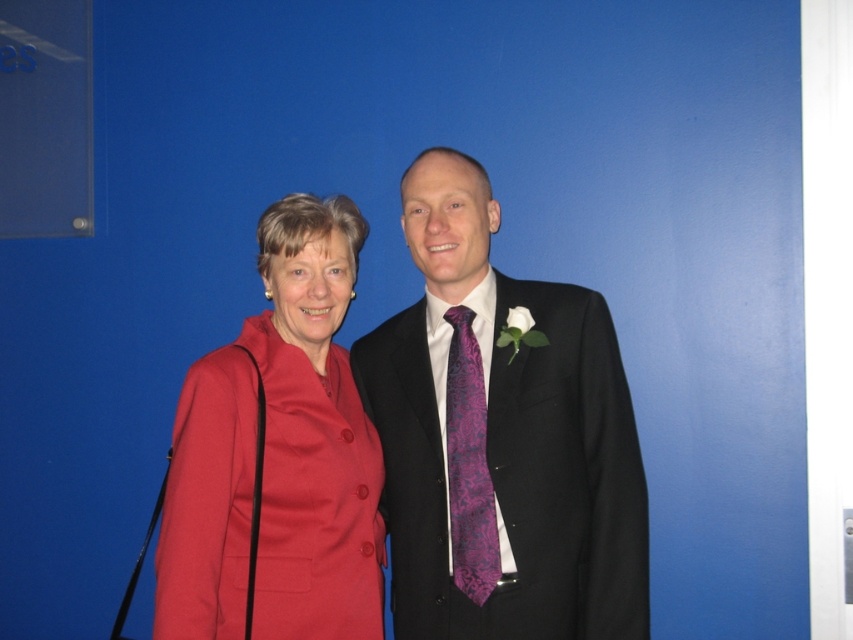
You are a photographer setting up for a portrait session. You have a camera with a focal length of 50mm and want to ensure the matte black suit at center is in focus. If the recommended focusing distance for this setup is between 5 and 6 feet, is the current distance appropriate?

The distance of matte black suit at center from camera is 5.65 feet, which falls within the recommended focusing distance range of 5 to 6 feet. Therefore, the current distance is appropriate for keeping the matte black suit at center in focus.

You are a photographer setting up for a group photo. You need to ensure that the matte red coat at center and the purple textured tie at center are clearly visible in the frame. Given that your camera has a minimum focus distance of 12 inches, will you need to adjust your position to capture both objects in focus?

The distance between the matte red coat at center and the purple textured tie at center is 11.52 inches, which is less than the camera minimum focus distance of 12 inches. Therefore, you will need to move closer to ensure both objects are in focus.